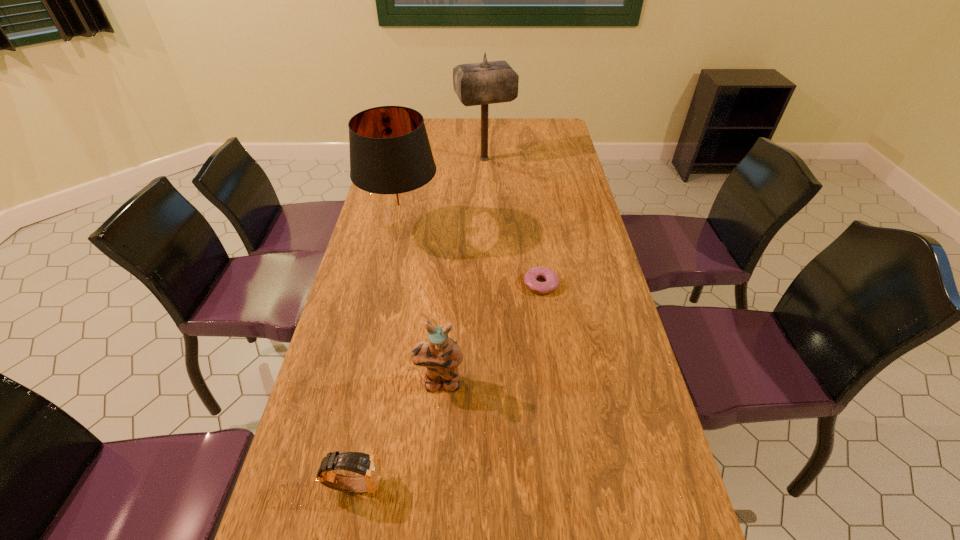
Find the location of `vacant space located on the front-facing side of the second nearest object`. vacant space located on the front-facing side of the second nearest object is located at coordinates (432, 492).

At what (x,y) coordinates should I click in order to perform the action: click on free space located on the face of the second shortest object. Please return your answer as a coordinate pair (x, y). The height and width of the screenshot is (540, 960). Looking at the image, I should click on (470, 484).

Where is `free region located on the left of the doughnut`? free region located on the left of the doughnut is located at coordinates (411, 284).

The height and width of the screenshot is (540, 960). In order to click on lampshade at the left edge in this screenshot , I will do `click(391, 160)`.

This screenshot has height=540, width=960. I want to click on watch that is at the left edge, so click(x=369, y=466).

Find the location of `object that is at the right edge`. object that is at the right edge is located at coordinates (530, 278).

In the image, there is a desktop. Identify the location of vacant space at the left edge. The width and height of the screenshot is (960, 540). (336, 514).

Locate an element on the screen. vacant region at the right edge of the desktop is located at coordinates (688, 521).

In the image, there is a desktop. What are the coordinates of `free region at the far right corner` in the screenshot? It's located at (534, 120).

You are a GUI agent. You are given a task and a screenshot of the screen. Output one action in this format:
    pyautogui.click(x=<x>, y=<y>)
    Task: Click on the free spot between the second nearest object and the shortest object
    The image size is (960, 540).
    Given the screenshot: What is the action you would take?
    pyautogui.click(x=491, y=334)